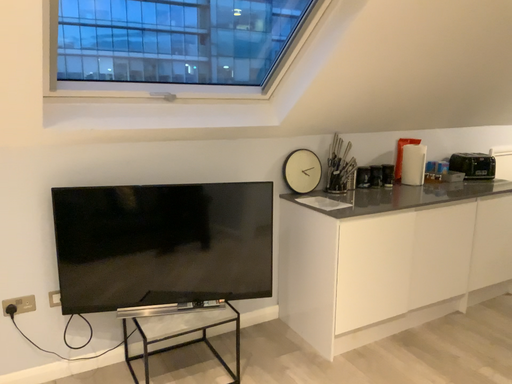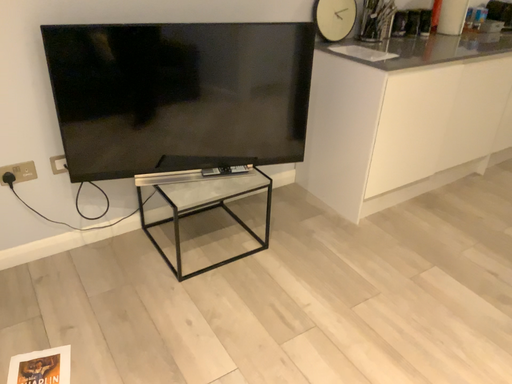
Question: How did the camera likely rotate when shooting the video?

Choices:
 (A) rotated upward
 (B) rotated downward

Answer: (B)